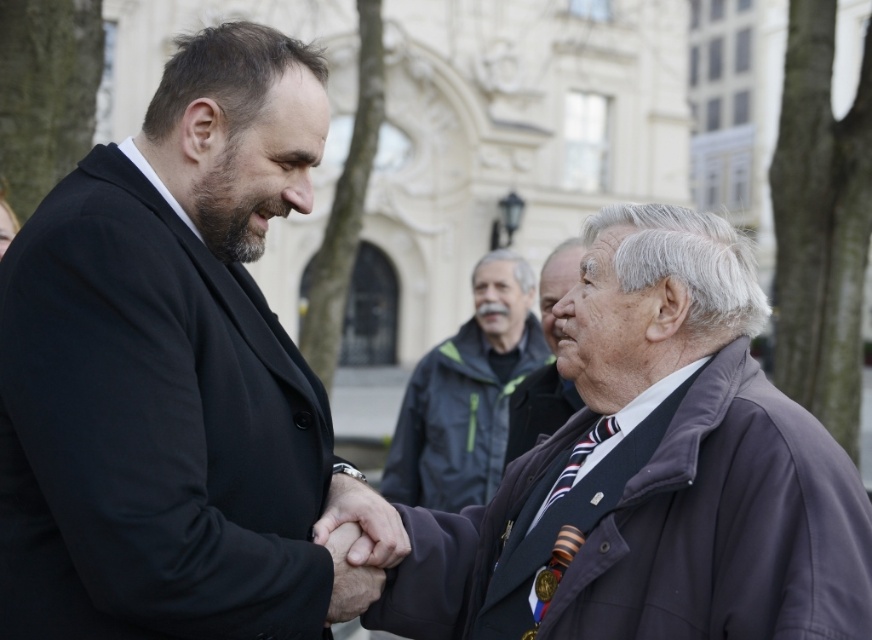
Consider the image. You are an observer standing in front of the scene. You see the dark gray jacket at center and the smooth skin hand at center. Which object is positioned to the right?

The dark gray jacket at center is to the right of the smooth skin hand at center.

You are a photographer trying to capture a closeup of the dark gray jacket at center and the smooth skin hand at center during the handshake. Given that your camera can only focus on objects larger than 10 cm, will both objects be in focus?

The dark gray jacket at center is bigger than the smooth skin hand at center. Since the camera requires objects larger than 10 cm to focus, and the dark gray jacket at center is larger, it will be in focus. However, the smooth skin hand at center may be too small if it is under 10 cm. But since the jacket is bigger, it meets the requirement.

You are a photographer standing at the camera position. You want to take a photo of the dark gray jacket at center. Is the jacket within the camera range of 50 meters?

The dark gray jacket at center and camera are 54.60 meters apart, so the jacket is outside the camera range of 50 meters.